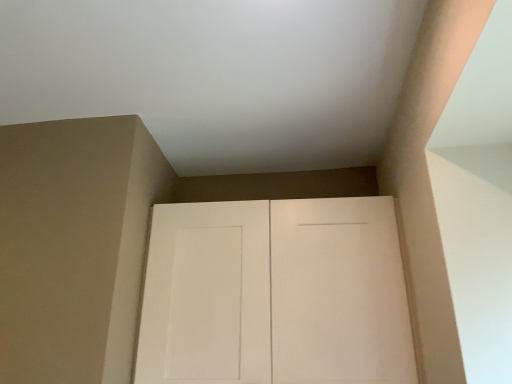
You are a GUI agent. You are given a task and a screenshot of the screen. Output one action in this format:
    pyautogui.click(x=<x>, y=<y>)
    Task: Click on the white matte cabinet at center
    Image resolution: width=512 pixels, height=384 pixels.
    Given the screenshot: What is the action you would take?
    pyautogui.click(x=275, y=294)

The image size is (512, 384). Describe the element at coordinates (275, 294) in the screenshot. I see `white matte cabinet at center` at that location.

Where is `white matte cabinet at center`? The height and width of the screenshot is (384, 512). white matte cabinet at center is located at coordinates (275, 294).